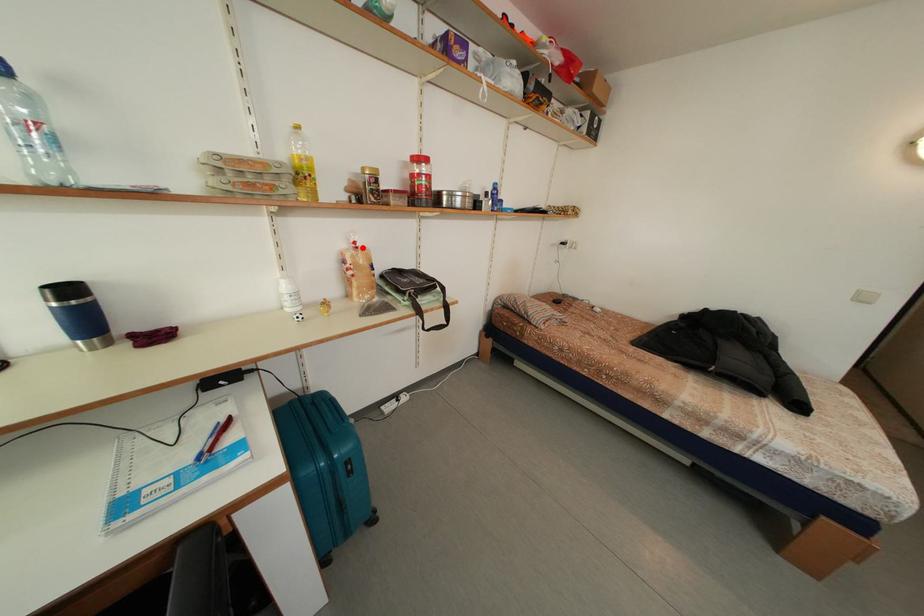
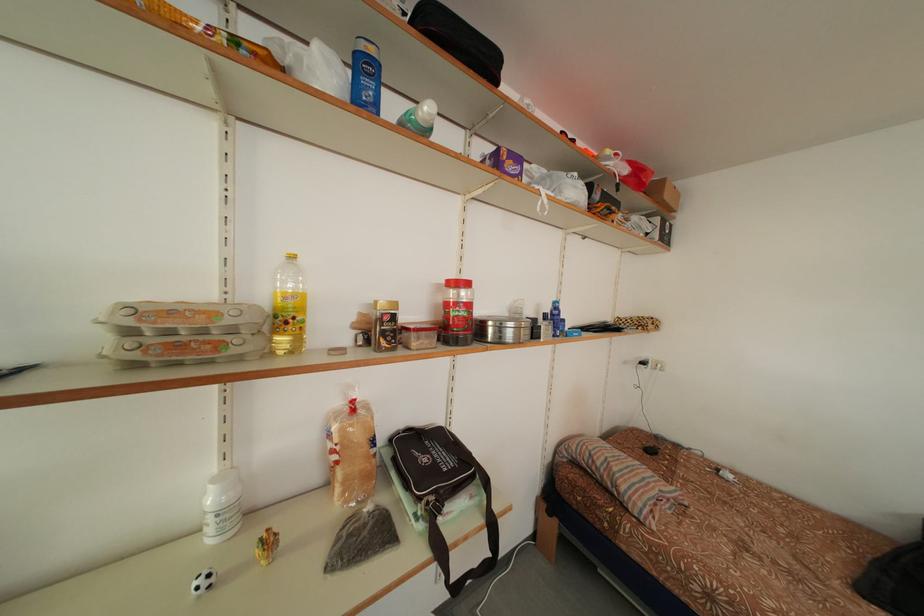
Question: I am providing you with two images of the same scene from different viewpoints. A red point is shown in image1. For the corresponding object point in image2, is it positioned nearer or farther from the camera?

Choices:
 (A) Nearer
 (B) Farther

Answer: (B)